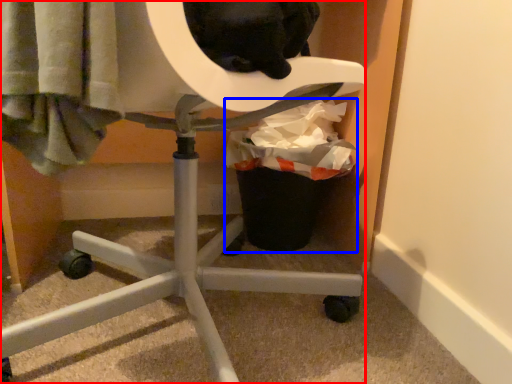
Question: Which point is closer to the camera, furniture (highlighted by a red box) or garbage (highlighted by a blue box)?

Choices:
 (A) furniture
 (B) garbage

Answer: (A)